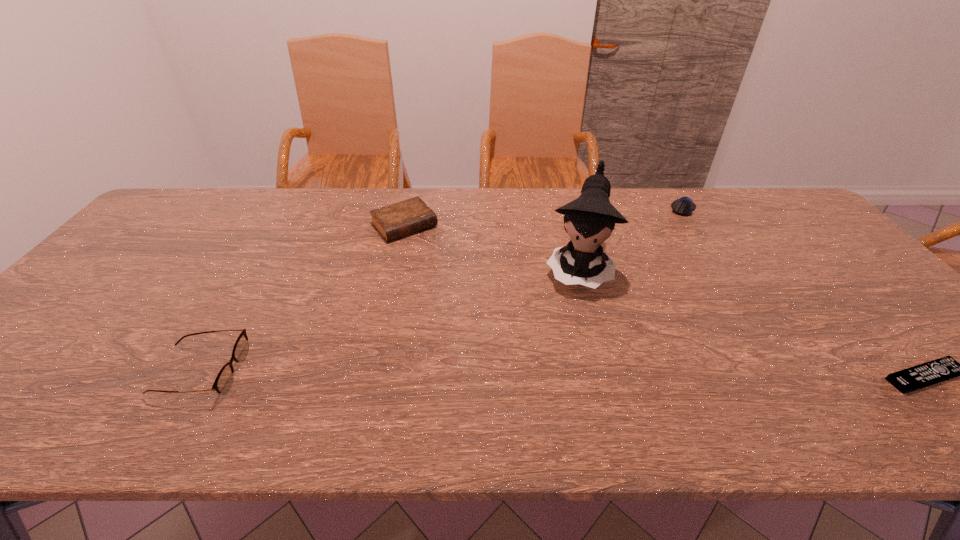
Where is `the leftmost object`? Image resolution: width=960 pixels, height=540 pixels. the leftmost object is located at coordinates (224, 380).

Where is `spectacles`? This screenshot has width=960, height=540. spectacles is located at coordinates (224, 380).

Locate an element on the screen. the third tallest object is located at coordinates [400, 219].

Locate an element on the screen. the fourth object from right to left is located at coordinates (400, 219).

Find the location of `the fourth object from left to right`. the fourth object from left to right is located at coordinates (684, 206).

Find the location of a particular element. computer mouse is located at coordinates (684, 206).

Where is `the tallest object`? The image size is (960, 540). the tallest object is located at coordinates point(590,219).

Image resolution: width=960 pixels, height=540 pixels. Find the location of `doll`. doll is located at coordinates (590, 219).

The image size is (960, 540). I want to click on free space located 0.160m on the face of the leftmost object, so click(312, 372).

At what (x,y) coordinates should I click in order to perform the action: click on free space located on the spine side of the third tallest object. Please return your answer as a coordinate pair (x, y). This screenshot has height=540, width=960. Looking at the image, I should click on pyautogui.click(x=478, y=307).